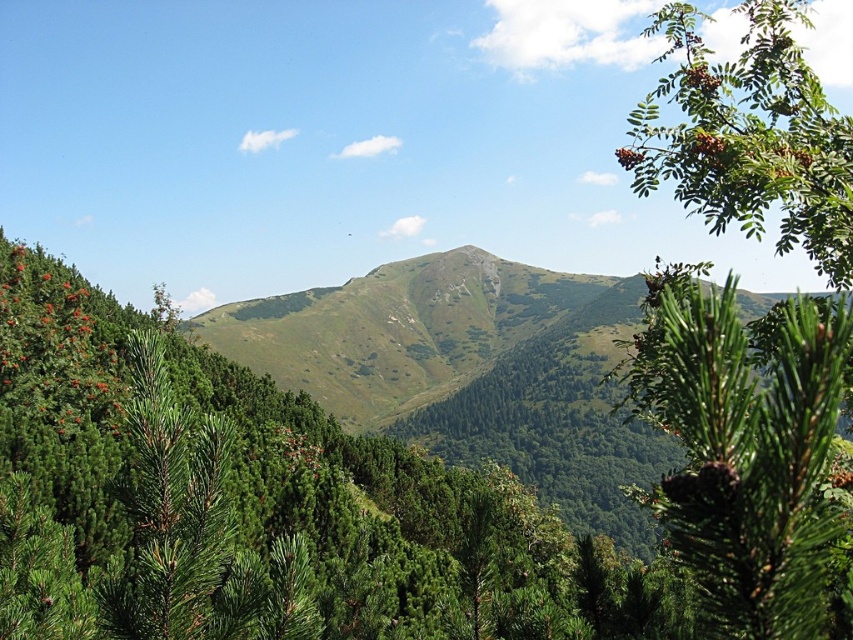
Can you confirm if green needle-like tree at center is positioned to the right of green matte pine cone at upper right?

No, green needle-like tree at center is not to the right of green matte pine cone at upper right.

Where is `green needle-like tree at center`? This screenshot has width=853, height=640. green needle-like tree at center is located at coordinates (368, 492).